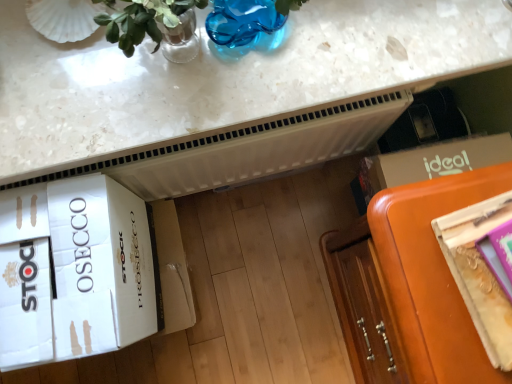
Find the location of `free location above white cardboard box at lower left (from a real-world perspective)`. free location above white cardboard box at lower left (from a real-world perspective) is located at coordinates (46, 263).